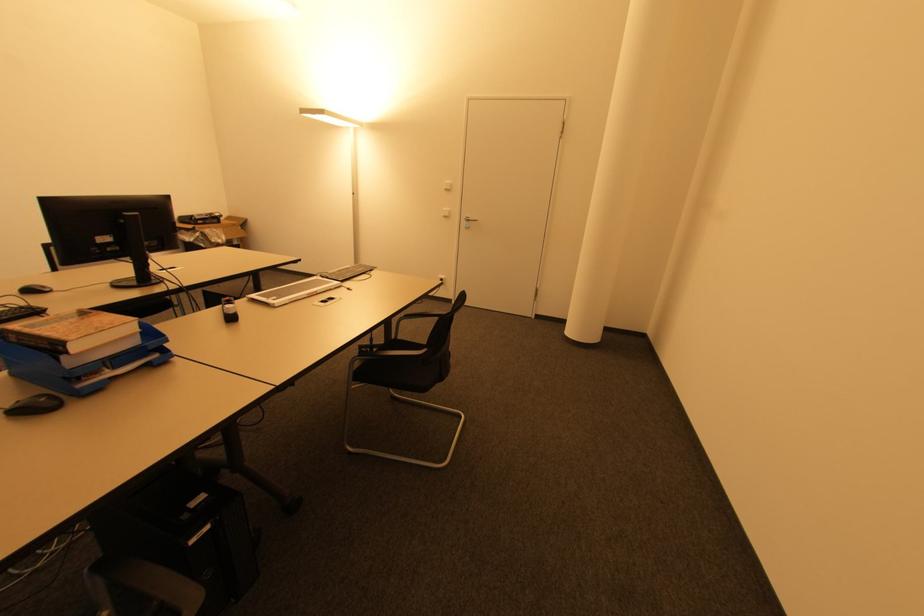
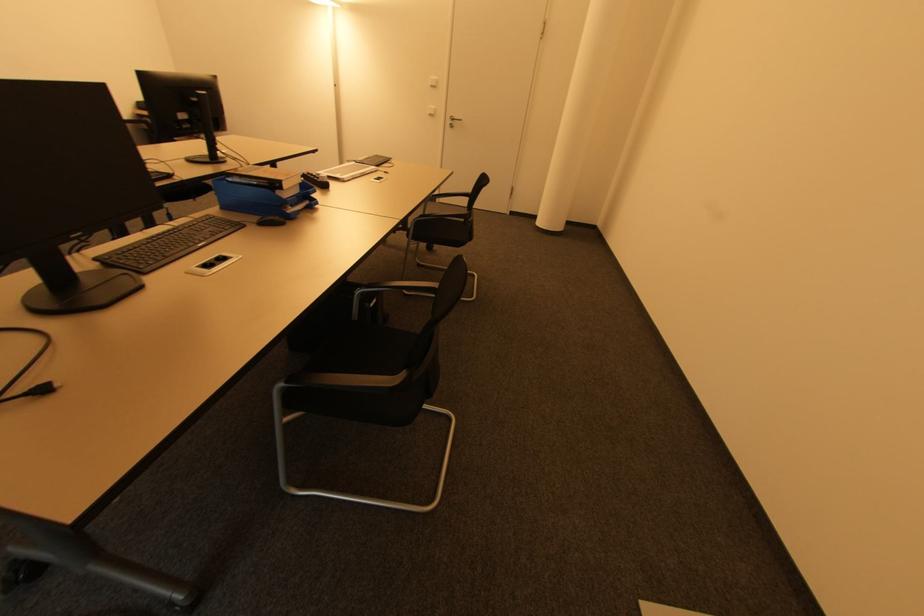
Find the pixel in the second image that matches (448,190) in the first image.

(434, 87)